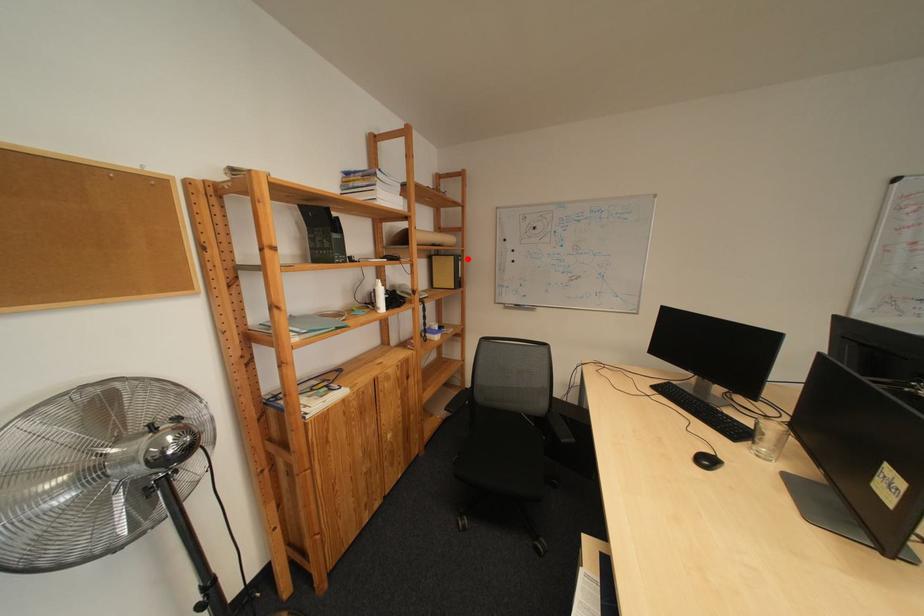
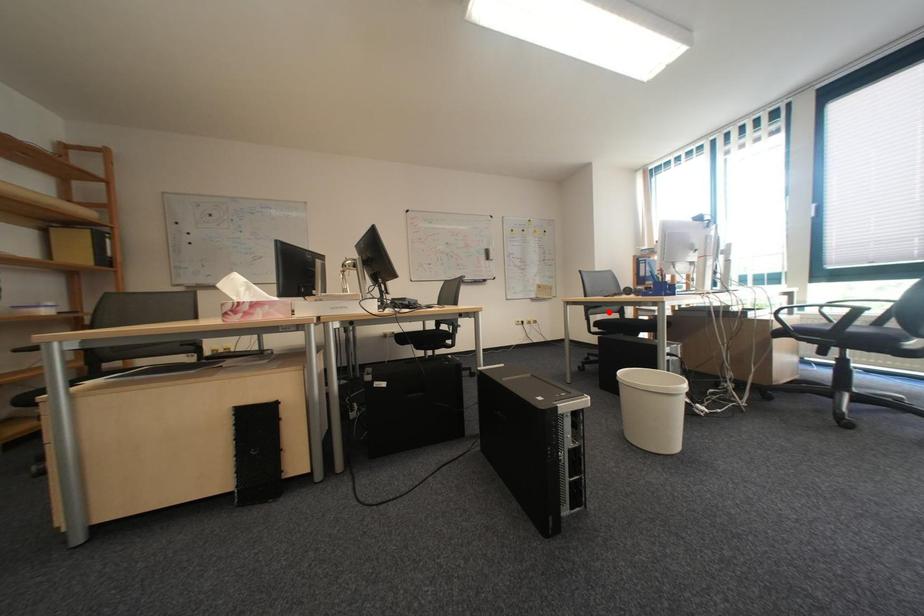
I am providing you with two images of the same scene from different viewpoints. A red point is marked on the first image and another point is marked on the second image. Is the marked point in image1 the same physical position as the marked point in image2?

No